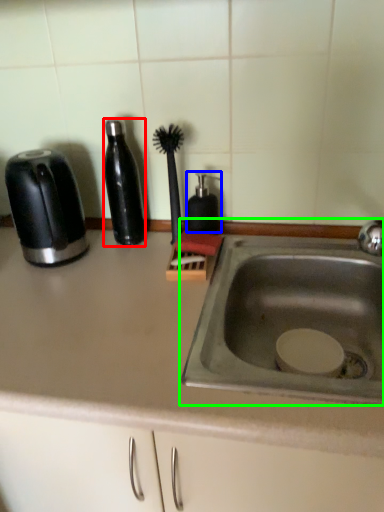
Question: Which object is positioned closest to bottle (highlighted by a red box)? Select from soap dispenser (highlighted by a blue box) and sink (highlighted by a green box).

Choices:
 (A) soap dispenser
 (B) sink

Answer: (A)